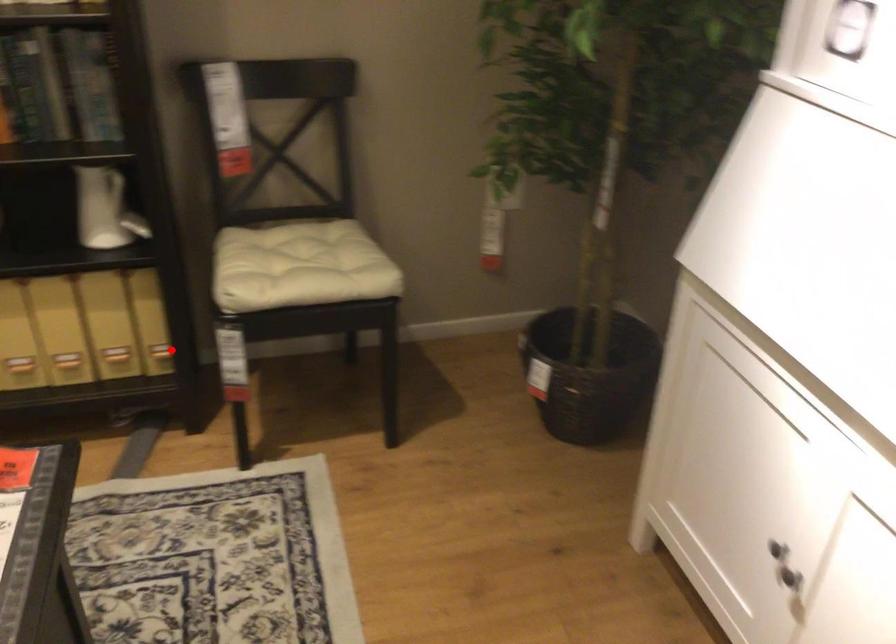
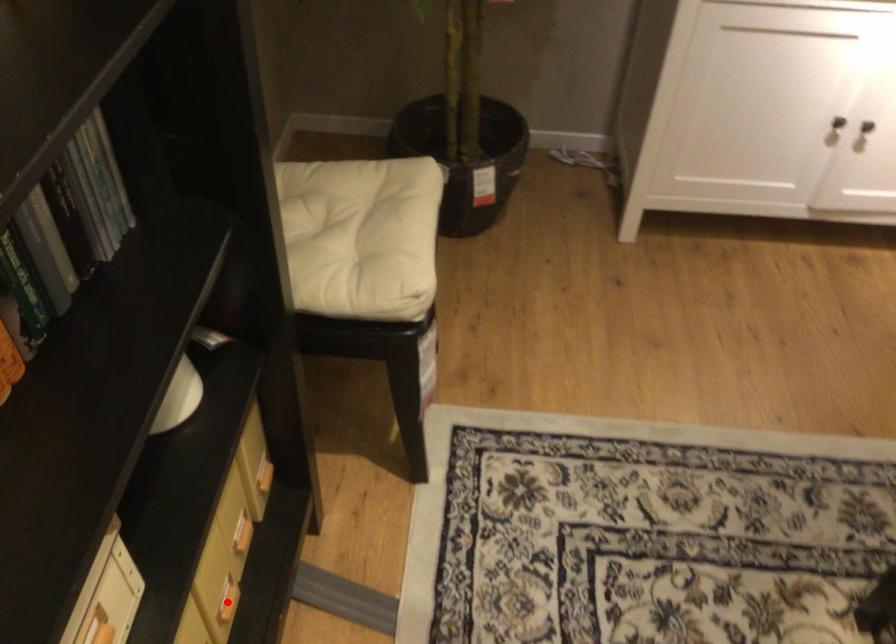
I am providing you with two images of the same scene from different viewpoints. A red point is marked on the first image and another point is marked on the second image. Are the points marked in image1 and image2 representing the same 3D position?

No